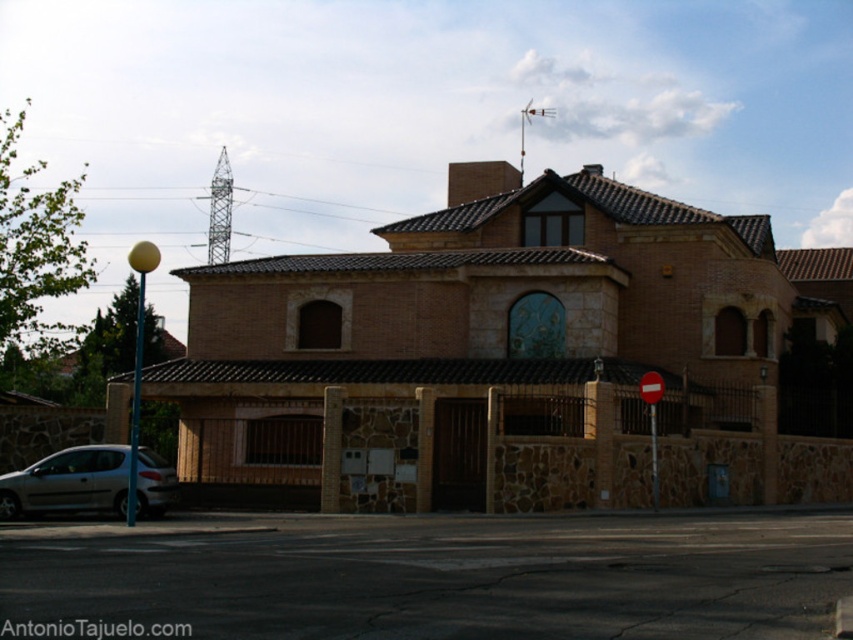
Question: Which object is farther from the camera taking this photo?

Choices:
 (A) red plastic stop sign at center
 (B) silver metallic car at lower left

Answer: (A)

Question: Is silver metallic car at lower left thinner than red plastic stop sign at center?

Choices:
 (A) yes
 (B) no

Answer: (B)

Question: Is silver metallic car at lower left behind red plastic stop sign at center?

Choices:
 (A) no
 (B) yes

Answer: (A)

Question: Which point is closer to the camera?

Choices:
 (A) (165, 461)
 (B) (662, 387)

Answer: (A)

Question: Is silver metallic car at lower left to the right of red plastic stop sign at center from the viewer's perspective?

Choices:
 (A) no
 (B) yes

Answer: (A)

Question: Which of the following is the farthest from the observer?

Choices:
 (A) (15, 490)
 (B) (653, 378)

Answer: (B)